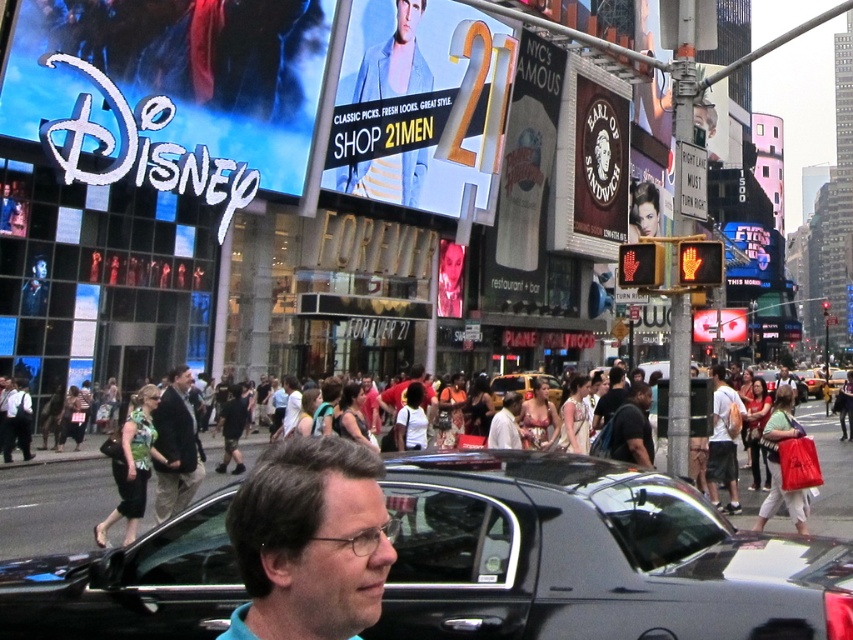
You are a delivery person needing to place a matte black backpack at center onto the roof of the yellow matte taxi cab at center. Can the backpack fit on top of the taxi without being taller than the vehicle?

The yellow matte taxi cab at center is shorter than the matte black backpack at center, so the backpack cannot fit on top of the taxi without exceeding its height.